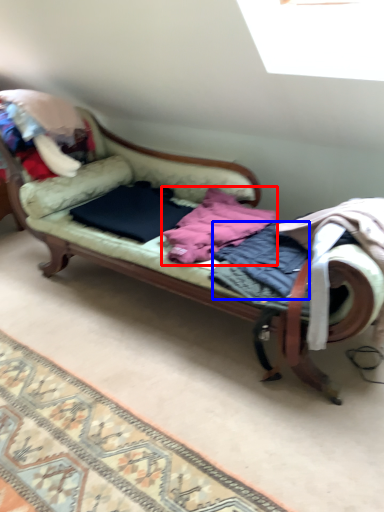
Question: Which of the following is the farthest to the observer, clothing (highlighted by a red box) or clothing (highlighted by a blue box)?

Choices:
 (A) clothing
 (B) clothing

Answer: (A)